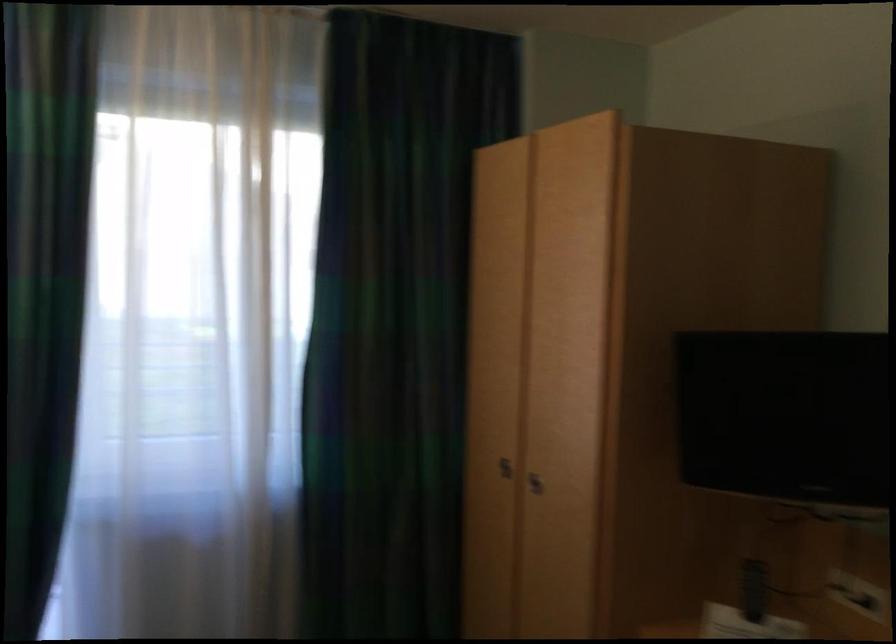
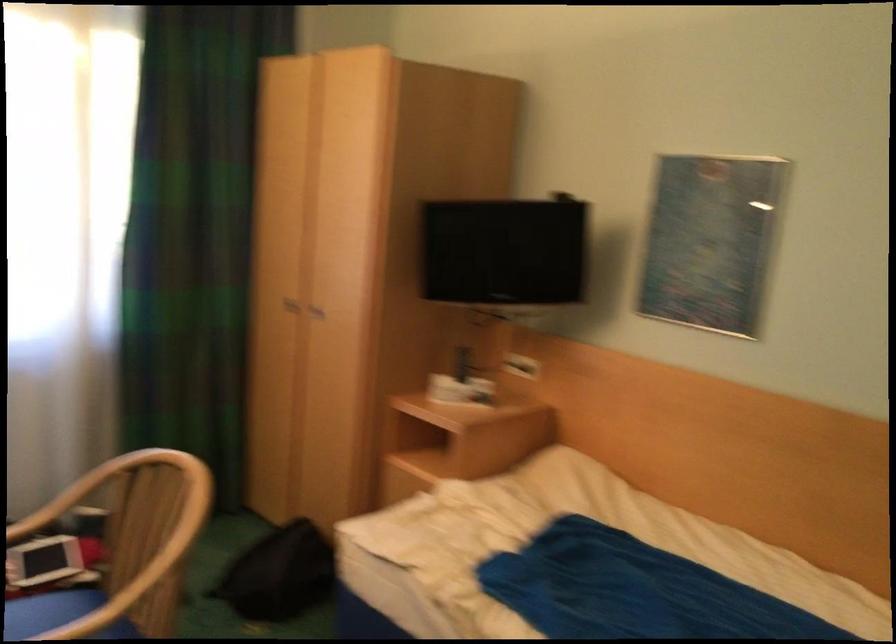
Question: Based on the continuous images, in which direction is the camera rotating? Reply with the corresponding letter.

Choices:
 (A) Left
 (B) Right
 (C) Up
 (D) Down

Answer: (B)